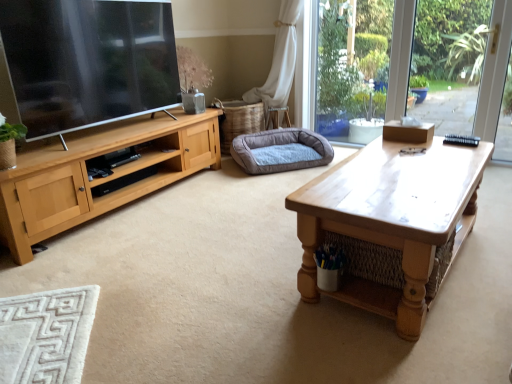
The image size is (512, 384). Identify the location of free space above wooden coffee table at center (from a real-world perspective). pos(402,169).